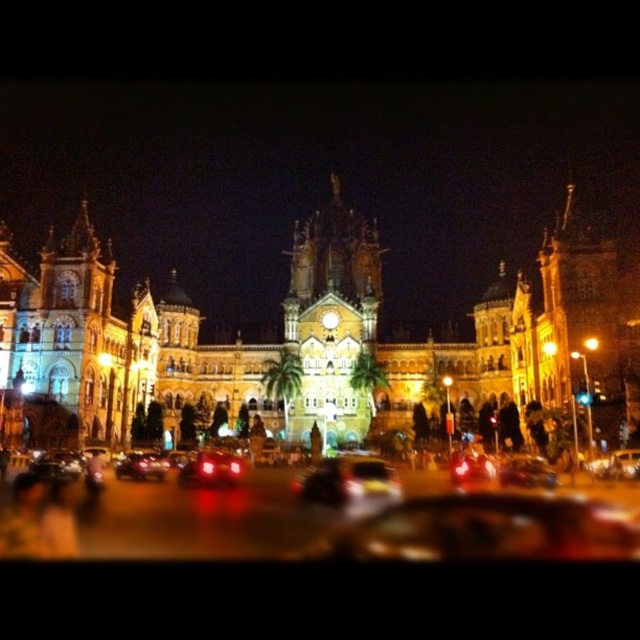
The image size is (640, 640). In order to click on yellow stone building at center in this screenshot , I will do `click(314, 339)`.

Measure the distance between yellow stone building at center and shiny black car at center.

yellow stone building at center and shiny black car at center are 41.29 meters apart.

You are a GUI agent. You are given a task and a screenshot of the screen. Output one action in this format:
    pyautogui.click(x=<x>, y=<y>)
    Task: Click on the yellow stone building at center
    
    Given the screenshot: What is the action you would take?
    pyautogui.click(x=314, y=339)

Who is positioned more to the left, shiny black car at center or matte black car at center?

matte black car at center

Which is above, shiny black car at center or matte black car at center?

matte black car at center is above.

Which is behind, point (381, 536) or point (188, 484)?

The point (188, 484) is behind.

The width and height of the screenshot is (640, 640). What are the coordinates of `shiny black car at center` in the screenshot? It's located at (490, 529).

Can you confirm if matte black car at center is taller than shiny red car at center?

Indeed, matte black car at center has a greater height compared to shiny red car at center.

Where is `matte black car at center`? The height and width of the screenshot is (640, 640). matte black car at center is located at coordinates (211, 468).

Describe the element at coordinates (211, 468) in the screenshot. I see `matte black car at center` at that location.

Find the location of a particular element. The image size is (640, 640). matte black car at center is located at coordinates (211, 468).